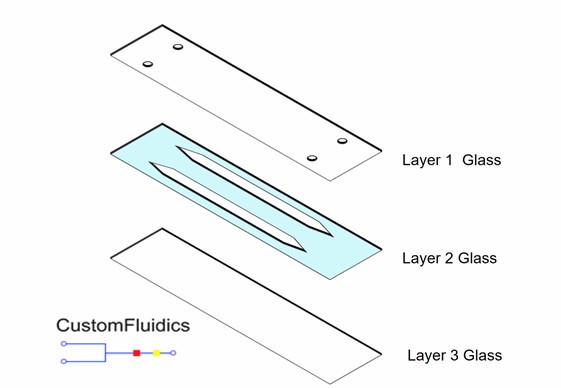
At what (x,y) coordinates should I click in order to perform the action: click on white shade. Please return your answer as a coordinate pair (x, y). Looking at the image, I should click on (250, 310), (264, 119).